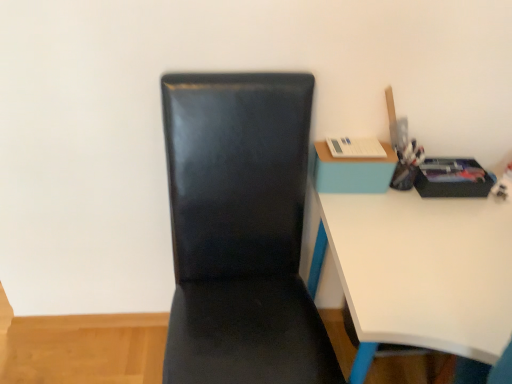
Question: In terms of size, does blue matte table at upper right appear bigger or smaller than black leather chair at center?

Choices:
 (A) small
 (B) big

Answer: (A)

Question: Considering the positions of blue matte table at upper right and black leather chair at center in the image, is blue matte table at upper right wider or thinner than black leather chair at center?

Choices:
 (A) thin
 (B) wide

Answer: (A)

Question: Estimate the real-world distances between objects in this image. Which object is closer to the blue matte table at upper right?

Choices:
 (A) white glossy desk at right
 (B) black leather chair at center

Answer: (A)

Question: Which object is the closest to the blue matte table at upper right?

Choices:
 (A) black leather chair at center
 (B) white glossy desk at right

Answer: (B)